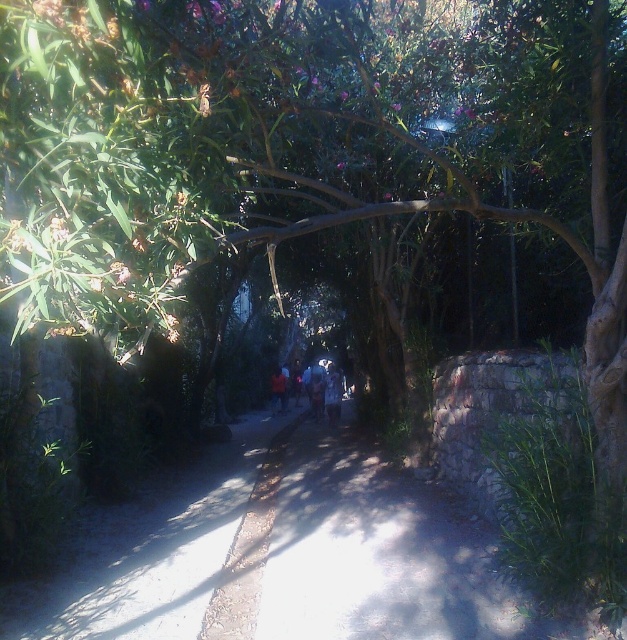
You are standing on the pathway and see both the blue denim jeans at center and the orange fabric at center. Which object is closer to you?

The blue denim jeans at center is closer to you because it is in front of the orange fabric at center.